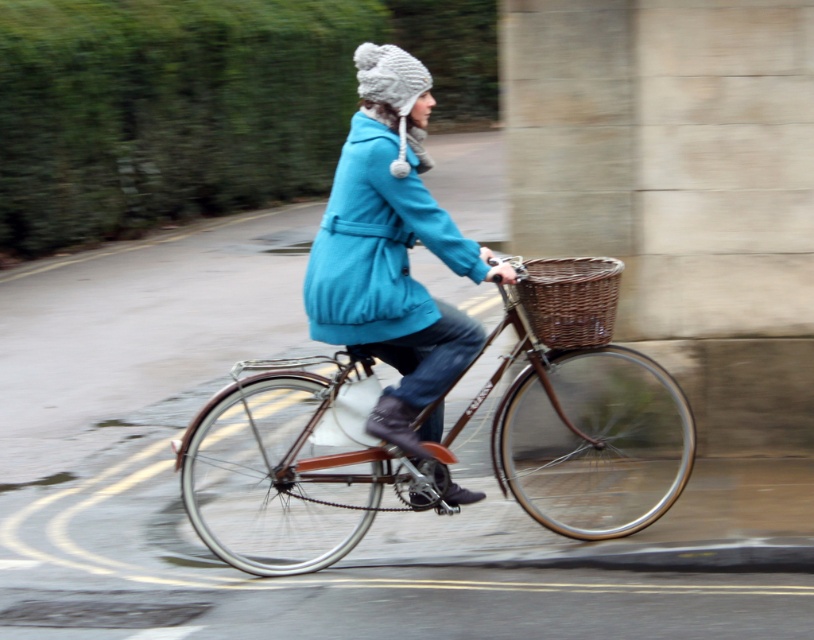
Between turquoise wool coat at center and matte blue coat at center, which one is positioned higher?

Positioned higher is matte blue coat at center.

Between turquoise wool coat at center and matte blue coat at center, which one appears on the right side from the viewer's perspective?

From the viewer's perspective, turquoise wool coat at center appears more on the right side.

Locate an element on the screen. The image size is (814, 640). turquoise wool coat at center is located at coordinates (392, 252).

I want to click on turquoise wool coat at center, so click(x=392, y=252).

Between brown wicker basket at center and matte blue coat at center, which one is positioned higher?

Positioned higher is matte blue coat at center.

Does brown wicker basket at center lie behind matte blue coat at center?

That is False.

Where is `brown wicker basket at center`? Image resolution: width=814 pixels, height=640 pixels. brown wicker basket at center is located at coordinates (445, 440).

Is brown wicker basket at center to the right of turquoise wool coat at center from the viewer's perspective?

In fact, brown wicker basket at center is to the left of turquoise wool coat at center.

Which is in front, point (349, 513) or point (394, 93)?

Point (394, 93) is more forward.

Measure the distance between point [418,472] and camera.

The distance of point [418,472] from camera is 22.61 feet.

Locate an element on the screen. The height and width of the screenshot is (640, 814). brown wicker basket at center is located at coordinates (445, 440).